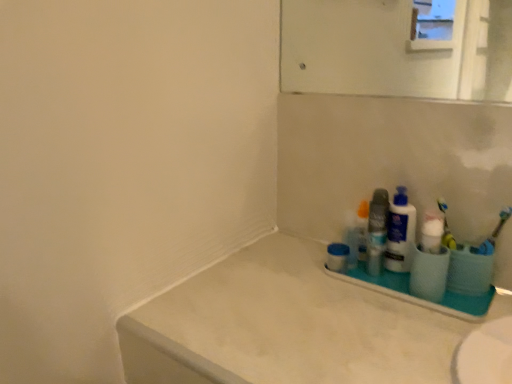
Find the location of a particular element. Image resolution: width=512 pixels, height=384 pixels. free location in front of blue matte jar at right is located at coordinates [352, 306].